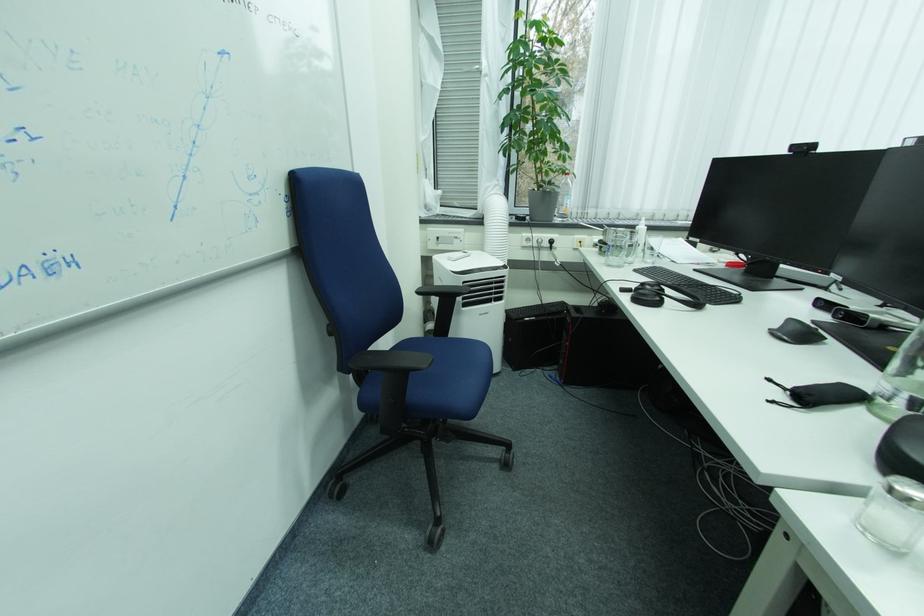
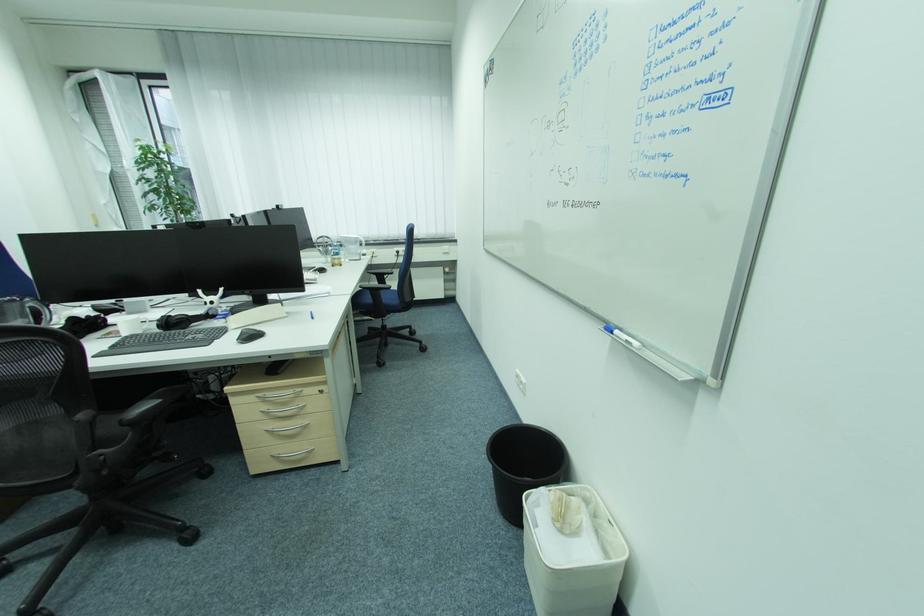
Which direction would the cameraman need to move to produce the second image?

The cameraman moved toward right, backward.